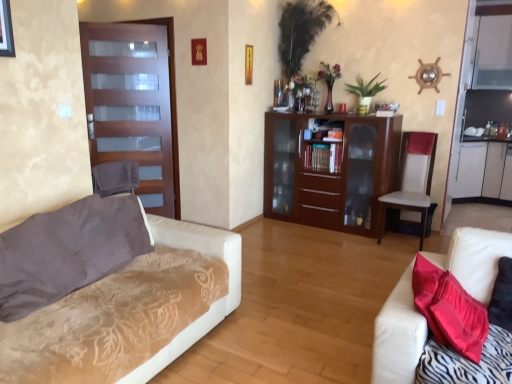
Question: Should I look upward or downward to see white textured couch at left, which ranks as the 1th studio couch in left-to-right order?

Choices:
 (A) down
 (B) up

Answer: (A)

Question: From the image's perspective, is velvet brown pillow at left on metallic gold picture frame at upper center, the 2th picture frame from the front?

Choices:
 (A) yes
 (B) no

Answer: (B)

Question: Does velvet brown pillow at left appear on the right side of metallic gold picture frame at upper center, which is counted as the 1th picture frame, starting from the back?

Choices:
 (A) no
 (B) yes

Answer: (A)

Question: Does velvet brown pillow at left lie behind metallic gold picture frame at upper center, arranged as the 2th picture frame when viewed from the left?

Choices:
 (A) yes
 (B) no

Answer: (B)

Question: From a real-world perspective, does velvet brown pillow at left stand above metallic gold picture frame at upper center, which is counted as the 1th picture frame, starting from the back?

Choices:
 (A) no
 (B) yes

Answer: (A)

Question: From the image's perspective, is velvet brown pillow at left under metallic gold picture frame at upper center, the 2th picture frame from the front?

Choices:
 (A) yes
 (B) no

Answer: (A)

Question: Is velvet brown pillow at left next to metallic gold picture frame at upper center, arranged as the 2th picture frame when viewed from the left?

Choices:
 (A) no
 (B) yes

Answer: (A)

Question: From the image's perspective, is brown wood cabinet at center over white leather couch at lower right, which appears as the first studio couch when viewed from the right?

Choices:
 (A) no
 (B) yes

Answer: (B)

Question: Considering the relative positions of brown wood cabinet at center and white leather couch at lower right, which appears as the first studio couch when viewed from the right, in the image provided, is brown wood cabinet at center behind white leather couch at lower right, which appears as the first studio couch when viewed from the right,?

Choices:
 (A) no
 (B) yes

Answer: (B)

Question: Could you tell me if brown wood cabinet at center is turned towards white leather couch at lower right, which is the second studio couch from left to right?

Choices:
 (A) yes
 (B) no

Answer: (A)

Question: Considering the relative positions of brown wood cabinet at center and white leather couch at lower right, which appears as the first studio couch when viewed from the right, in the image provided, is brown wood cabinet at center to the right of white leather couch at lower right, which appears as the first studio couch when viewed from the right, from the viewer's perspective?

Choices:
 (A) yes
 (B) no

Answer: (B)

Question: Is brown wood cabinet at center smaller than white leather couch at lower right, which is the second studio couch from left to right?

Choices:
 (A) no
 (B) yes

Answer: (A)

Question: Is brown wood cabinet at center turned away from white leather couch at lower right, which appears as the first studio couch when viewed from the right?

Choices:
 (A) no
 (B) yes

Answer: (A)

Question: From a real-world perspective, does white textured couch at left, placed as the second studio couch when sorted from right to left, stand above matte glass door at left?

Choices:
 (A) no
 (B) yes

Answer: (A)